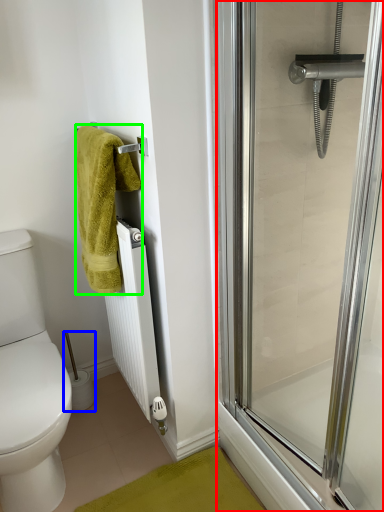
Question: Which is nearer to the screen door (highlighted by a red box)? toilet paper (highlighted by a blue box) or towel (highlighted by a green box).

Choices:
 (A) toilet paper
 (B) towel

Answer: (B)